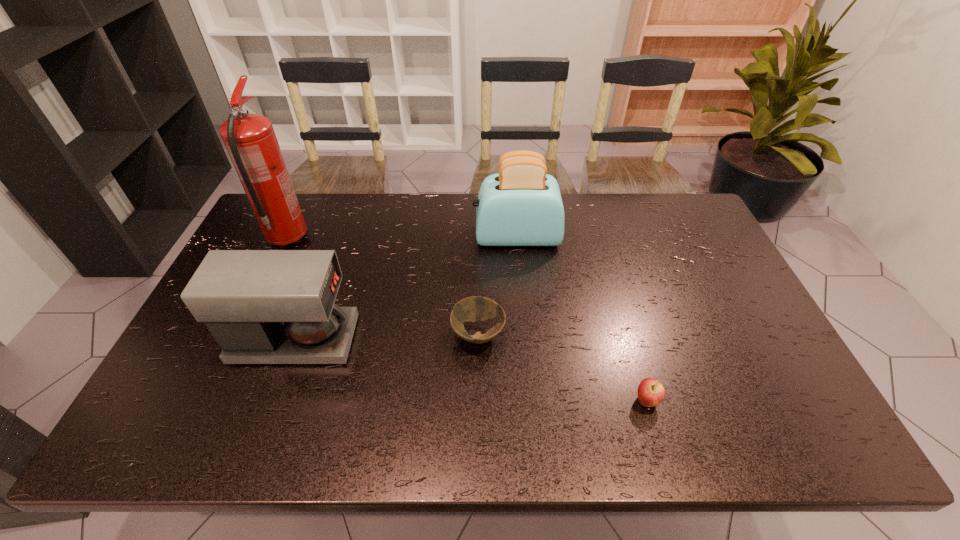
Locate an element on the screen. The height and width of the screenshot is (540, 960). the tallest object is located at coordinates (250, 140).

Locate an element on the screen. The height and width of the screenshot is (540, 960). toaster is located at coordinates (521, 205).

Image resolution: width=960 pixels, height=540 pixels. I want to click on the third tallest object, so click(262, 306).

The image size is (960, 540). What are the coordinates of `the fourth tallest object` in the screenshot? It's located at (651, 392).

Locate an element on the screen. This screenshot has width=960, height=540. apple is located at coordinates 651,392.

This screenshot has width=960, height=540. Find the location of `the shortest object`. the shortest object is located at coordinates (476, 308).

Where is `vacant space located 0.100m on the handle side the tallest object`? vacant space located 0.100m on the handle side the tallest object is located at coordinates (304, 204).

Identify the location of free space located on the handle side the tallest object. (308, 198).

Identify the location of free spot located on the handle side the tallest object. (300, 213).

Locate an element on the screen. The image size is (960, 540). free space located on the side of the fourth shortest object with the lever is located at coordinates (392, 237).